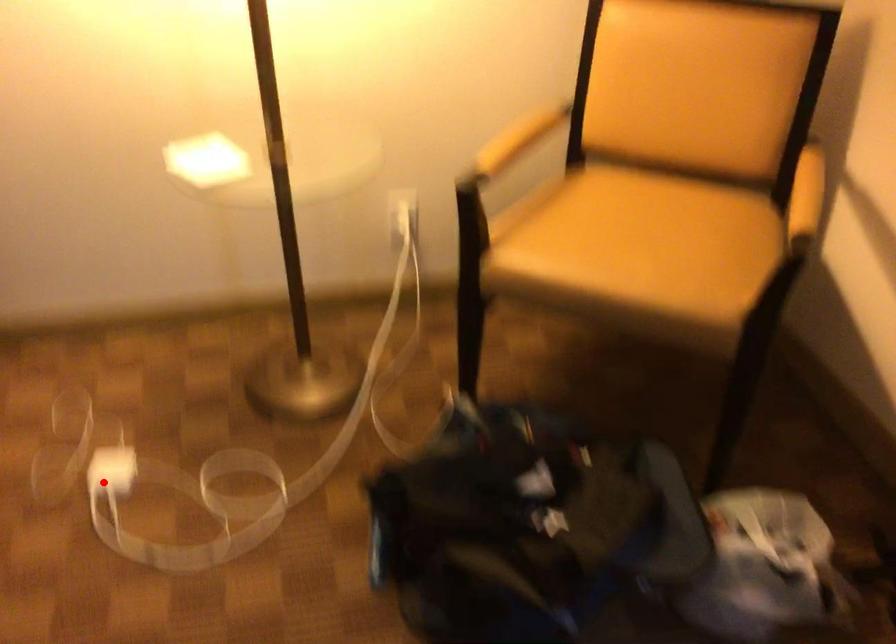
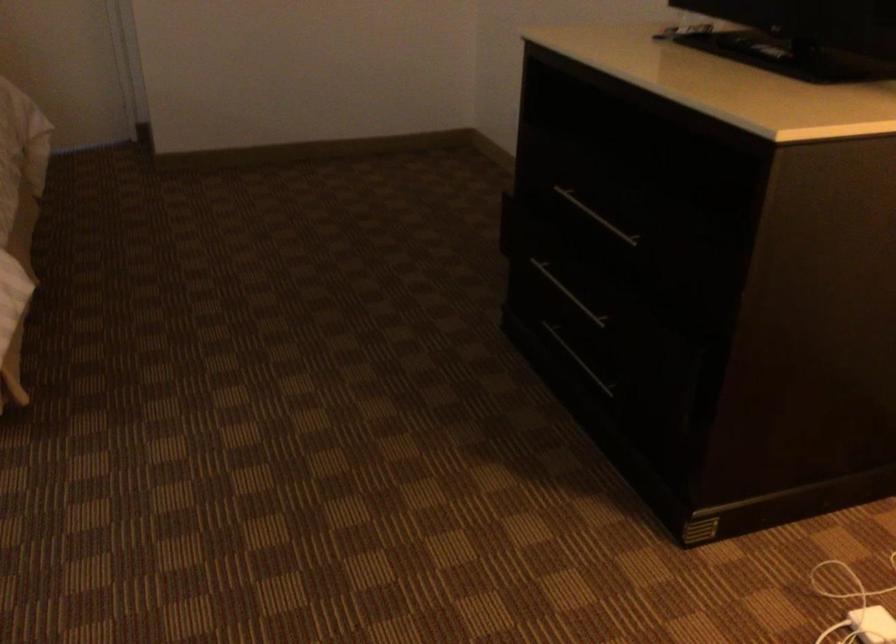
Locate, in the second image, the point that corresponds to the highlighted location in the first image.

(872, 625)